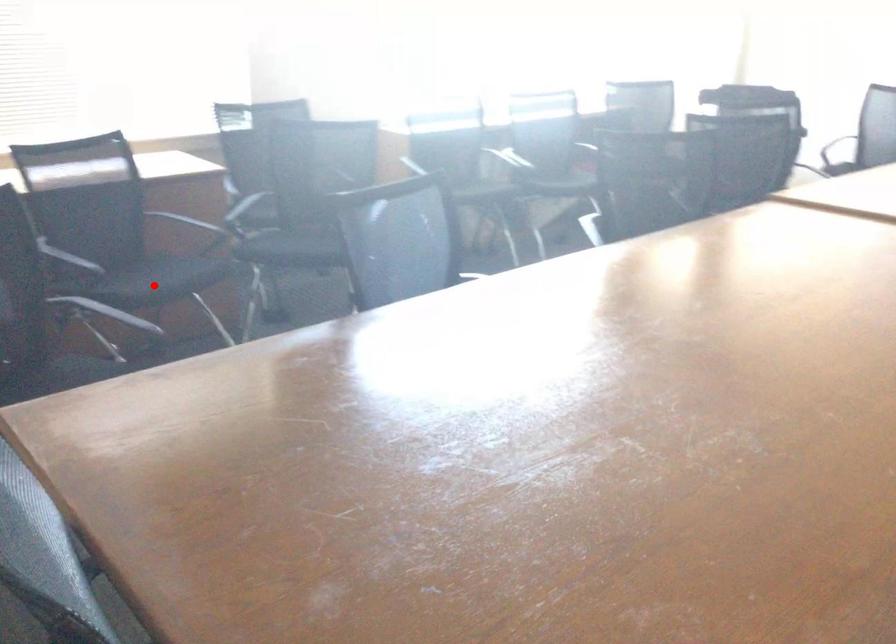
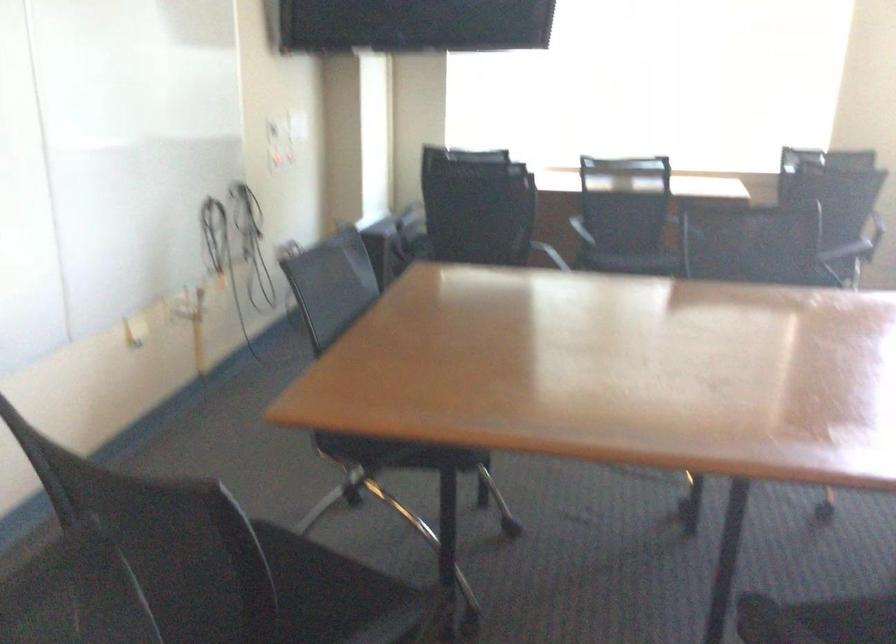
Question: I am providing you with two images of the same scene from different viewpoints. In image1, a red point is highlighted. Considering the same 3D point in image2, which of the following is correct?

Choices:
 (A) It is closer
 (B) It is farther

Answer: (B)